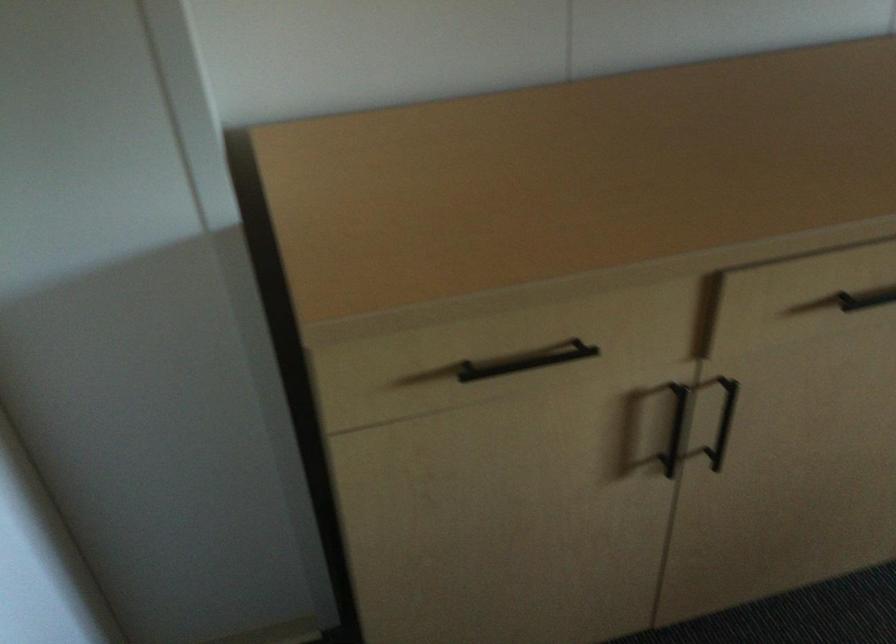
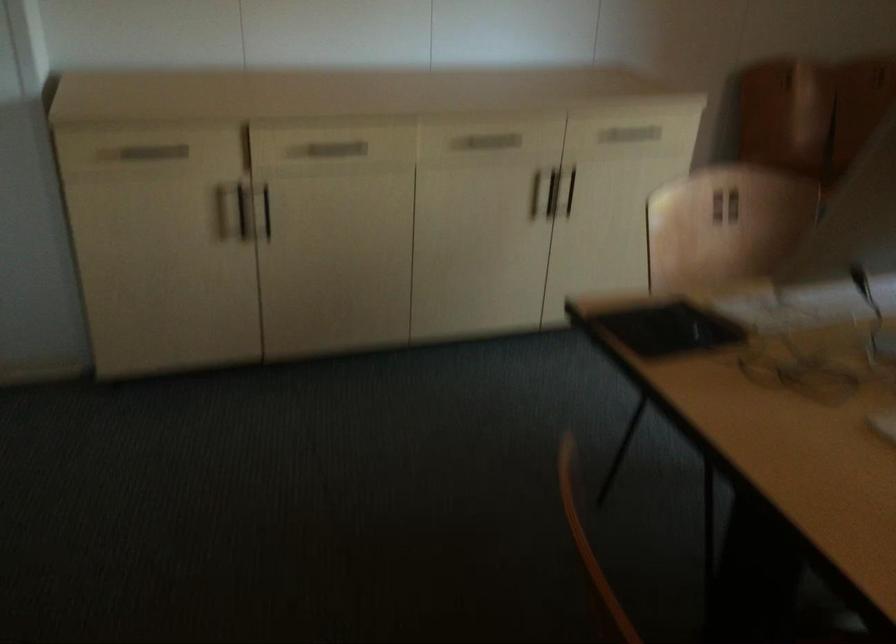
Which direction would the cameraman need to move to produce the second image?

The cameraman walked toward right, backward.